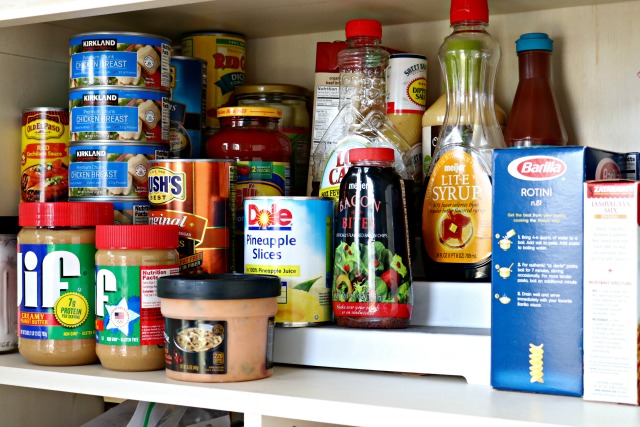
Find the location of a particular element. Image resolution: width=640 pixels, height=427 pixels. food in bottles is located at coordinates (351, 133), (474, 167), (406, 125), (427, 121), (537, 125).